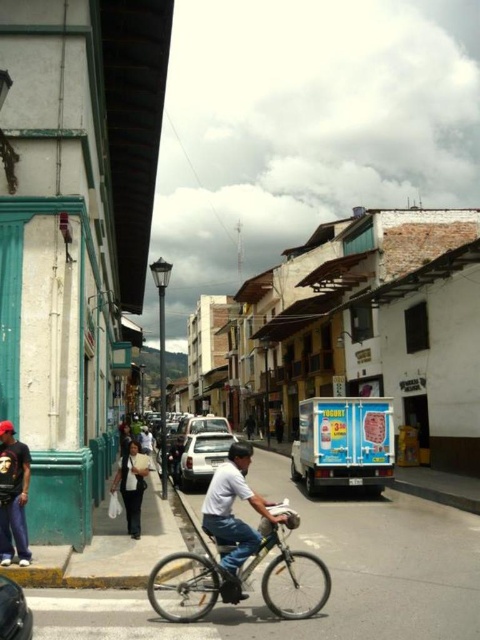
You are a delivery person trying to navigate through the street. You see the dark blue jeans at lower left and the white matte car at center. Which object is narrower so you can pass through safely?

The dark blue jeans at lower left is thinner than the white matte car at center, so you can pass through safely by going around the dark blue jeans at lower left since it is narrower.

You are a pedestrian standing at the crosswalk and see the silver metallic bicycle at center and the shiny black car at lower left. Which one is closer to the crosswalk?

The shiny black car at lower left is closer to the crosswalk since it is positioned to the left of the silver metallic bicycle at center, which is further to the right.

You are a pedestrian standing on the sidewalk and want to cross the street where the dark blue jeans at lower left and the white matte car at center are located. Which object should you avoid stepping on first as you cross?

You should avoid stepping on the dark blue jeans at lower left first because it is positioned to the left of the white matte car at center, meaning it is closer to your path when crossing from the sidewalk.